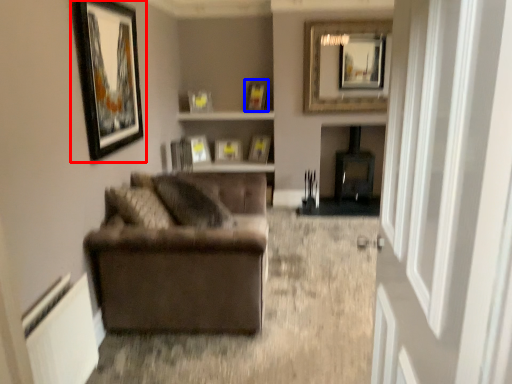
Question: Which point is closer to the camera, picture frame (highlighted by a red box) or picture frame (highlighted by a blue box)?

Choices:
 (A) picture frame
 (B) picture frame

Answer: (A)